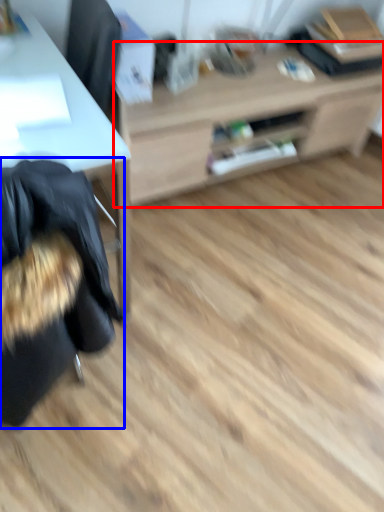
Question: Which object appears farthest to the camera in this image, table (highlighted by a red box) or bean bag chair (highlighted by a blue box)?

Choices:
 (A) table
 (B) bean bag chair

Answer: (A)